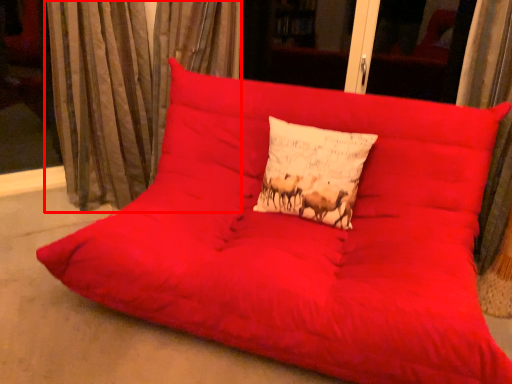
Question: From the image's perspective, where is curtain (annotated by the red box) located relative to pillow?

Choices:
 (A) below
 (B) above

Answer: (B)